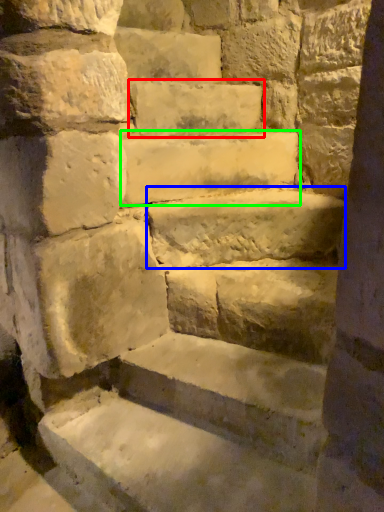
Question: Considering the real-world distances, which object is closest to brick (highlighted by a red box)? limestone (highlighted by a blue box) or stone (highlighted by a green box).

Choices:
 (A) limestone
 (B) stone

Answer: (B)